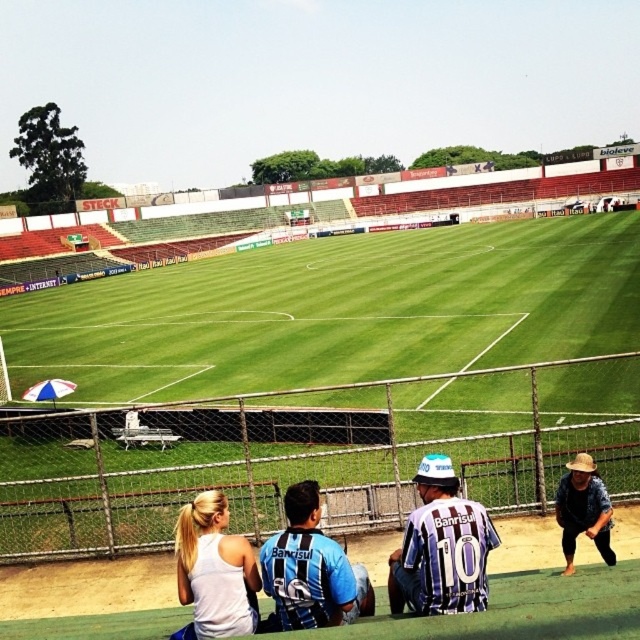
Question: In this image, where is blue jersey at center located relative to white matte tank top at lower center?

Choices:
 (A) above
 (B) below

Answer: (A)

Question: Which object is the farthest from the blue jersey at center?

Choices:
 (A) white matte tank top at lower center
 (B) purple striped jersey at center

Answer: (B)

Question: Which object is the farthest from the purple striped jersey at center?

Choices:
 (A) blue jersey at center
 (B) white matte tank top at lower center
 (C) brown woven hat at lower right

Answer: (C)

Question: Which object is closer to the camera taking this photo?

Choices:
 (A) white matte tank top at lower center
 (B) purple striped jersey at center
 (C) brown woven hat at lower right

Answer: (B)

Question: In this image, where is purple striped jersey at center located relative to brown woven hat at lower right?

Choices:
 (A) left
 (B) right

Answer: (A)

Question: Does blue jersey at center have a lesser width compared to white matte tank top at lower center?

Choices:
 (A) no
 (B) yes

Answer: (A)